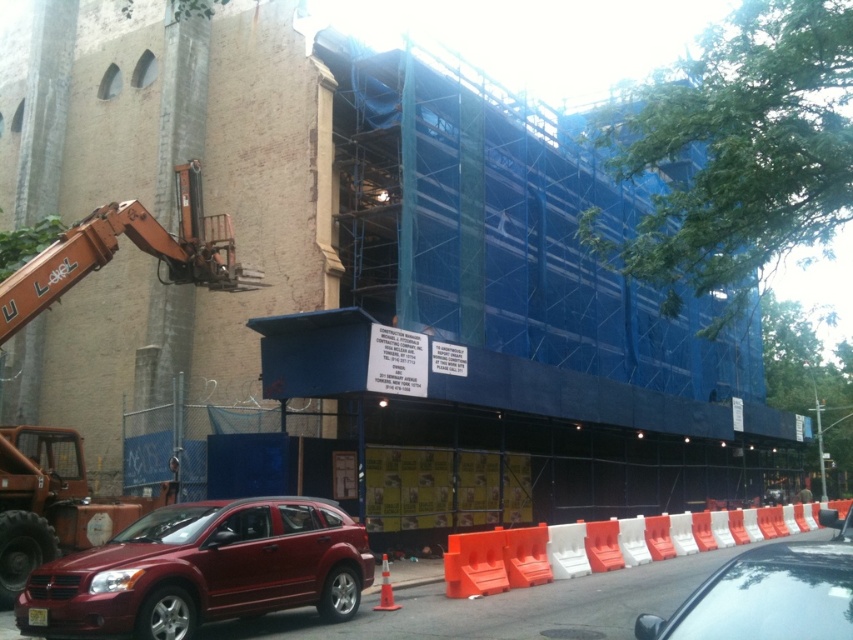
Question: Can you confirm if shiny red suv at lower left is bigger than orange plastic barrier at lower right?

Choices:
 (A) yes
 (B) no

Answer: (B)

Question: Can you confirm if shiny red suv at lower left is positioned above glossy red car at center?

Choices:
 (A) no
 (B) yes

Answer: (B)

Question: Among these points, which one is nearest to the camera?

Choices:
 (A) (256, 588)
 (B) (790, 557)
 (C) (567, 534)

Answer: (B)

Question: Which point is farther to the camera?

Choices:
 (A) glossy red car at center
 (B) orange plastic barrier at lower right

Answer: (B)

Question: Does shiny red suv at lower left have a greater width compared to orange plastic barrier at lower right?

Choices:
 (A) no
 (B) yes

Answer: (A)

Question: Which point is closer to the camera?

Choices:
 (A) (612, 554)
 (B) (206, 609)
 (C) (805, 632)

Answer: (C)